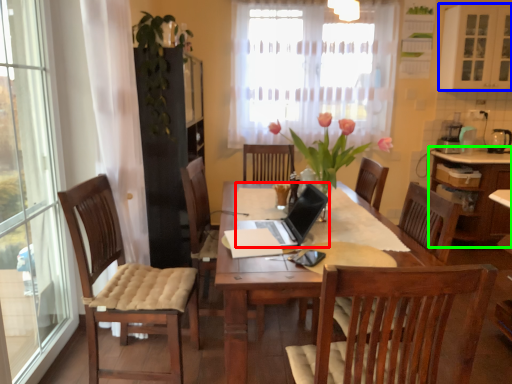
Question: Which is farther away from laptop (highlighted by a red box)? cabinetry (highlighted by a blue box) or cabinetry (highlighted by a green box)?

Choices:
 (A) cabinetry
 (B) cabinetry

Answer: (A)